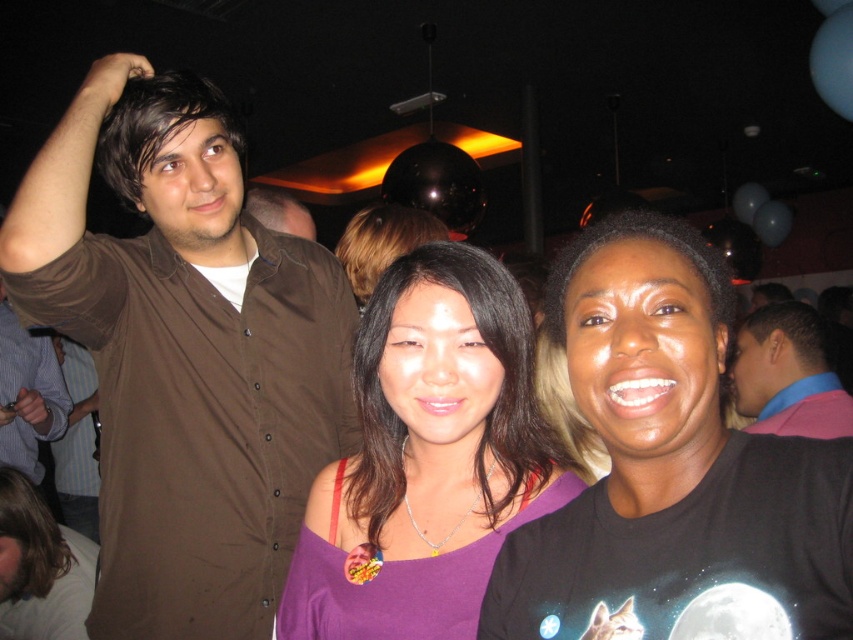
Is point (819, 449) positioned in front of point (260, 209)?

Yes, point (819, 449) is closer to viewer.

Is black matte t-shirt at center taller than brown shirt at center?

Yes.

Is point (577, 301) in front of point (260, 188)?

Yes, it is.

Identify the location of black matte t-shirt at center. (671, 468).

Who is more forward, (631,372) or (374,381)?

Point (631,372) is in front.

Can you confirm if black matte t-shirt at center is taller than purple satin top at center?

In fact, black matte t-shirt at center may be shorter than purple satin top at center.

Who is more forward, (752,624) or (445,500)?

Point (752,624) is in front.

Where is `black matte t-shirt at center`? Image resolution: width=853 pixels, height=640 pixels. black matte t-shirt at center is located at coordinates (671, 468).

Does purple satin top at center appear over dark brown hair at center?

Incorrect, purple satin top at center is not positioned above dark brown hair at center.

Who is positioned more to the left, purple satin top at center or dark brown hair at center?

dark brown hair at center

Between point (364, 584) and point (402, 248), which one is positioned in front?

Point (364, 584) is more forward.

You are a GUI agent. You are given a task and a screenshot of the screen. Output one action in this format:
    pyautogui.click(x=<x>, y=<y>)
    Task: Click on the purple satin top at center
    
    Given the screenshot: What is the action you would take?
    pyautogui.click(x=428, y=456)